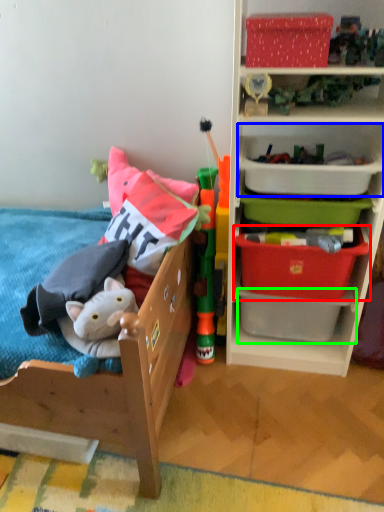
Question: Considering the real-world distances, which object is farthest from storage box (highlighted by a red box)? storage box (highlighted by a blue box) or storage box (highlighted by a green box)?

Choices:
 (A) storage box
 (B) storage box

Answer: (A)